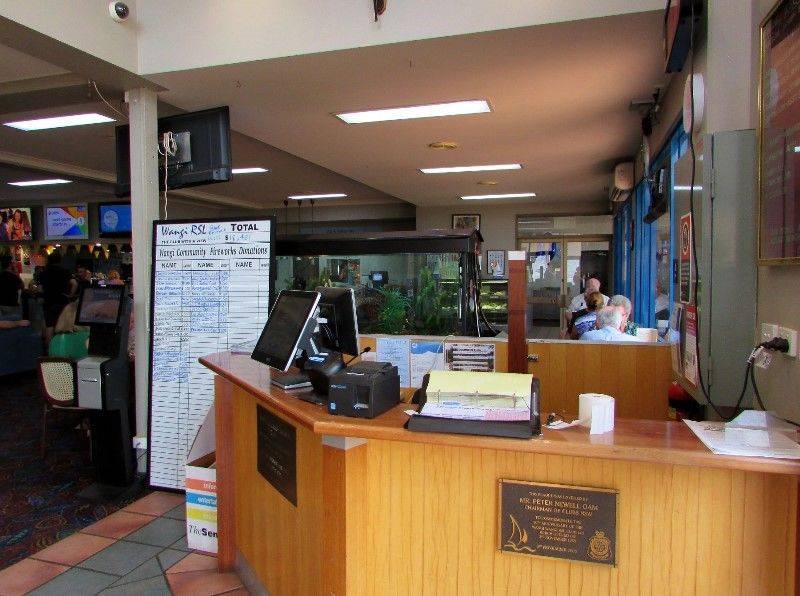
This screenshot has height=596, width=800. I want to click on calendar, so click(x=490, y=415).